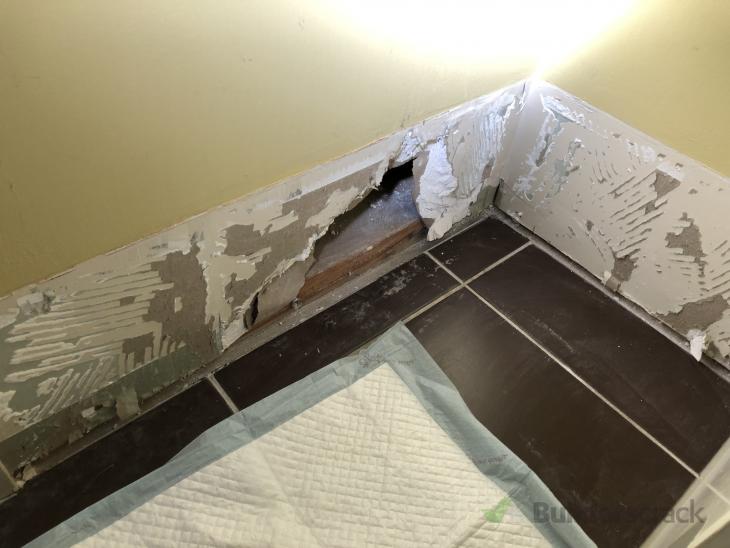
This screenshot has height=548, width=730. In order to click on drywall in this screenshot , I will do click(288, 253).